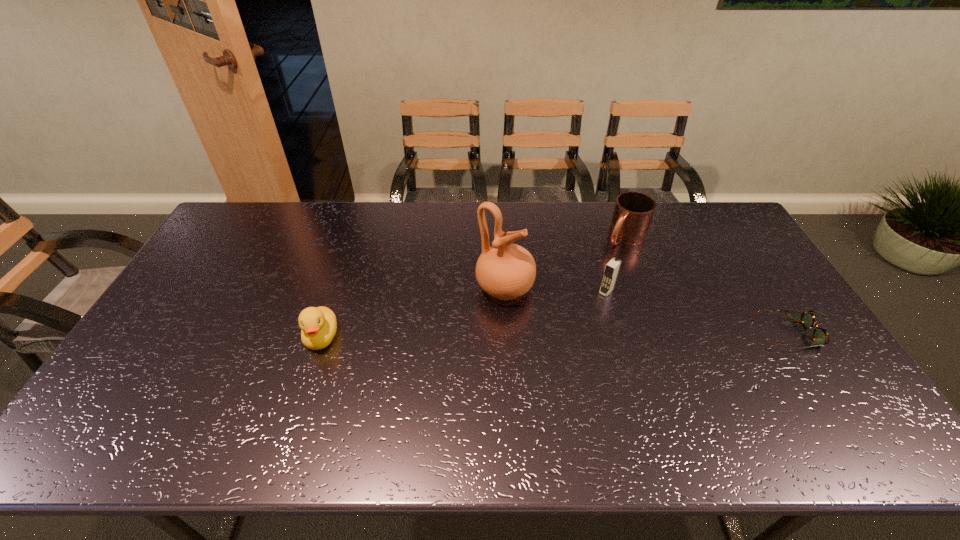
In order to click on vacant area that lies between the tallest object and the spectacles in this screenshot , I will do [x=650, y=311].

At what (x,y) coordinates should I click in order to perform the action: click on free area in between the farthest object and the second object from left to right. Please return your answer as a coordinate pair (x, y). Looking at the image, I should click on (565, 262).

This screenshot has width=960, height=540. What are the coordinates of `free space between the tallest object and the fourth shortest object` in the screenshot? It's located at (556, 290).

You are a GUI agent. You are given a task and a screenshot of the screen. Output one action in this format:
    pyautogui.click(x=<x>, y=<y>)
    Task: Click on the vacant space in between the third object from left to right and the leftmost object
    This screenshot has width=960, height=540.
    Given the screenshot: What is the action you would take?
    pyautogui.click(x=464, y=314)

The width and height of the screenshot is (960, 540). Find the location of `free point between the second tallest object and the duckling`. free point between the second tallest object and the duckling is located at coordinates (464, 314).

The height and width of the screenshot is (540, 960). What are the coordinates of `vacant region between the mug and the rightmost object` in the screenshot? It's located at (710, 285).

Where is `free space between the rightmost object and the second tallest object`? The width and height of the screenshot is (960, 540). free space between the rightmost object and the second tallest object is located at coordinates (701, 312).

The height and width of the screenshot is (540, 960). Find the location of `unoccupied area between the cellular telephone and the leftmost object`. unoccupied area between the cellular telephone and the leftmost object is located at coordinates (464, 314).

Identify which object is located as the fourth nearest to the mug. Please provide its 2D coordinates. Your answer should be formatted as a tuple, i.e. [(x, y)], where the tuple contains the x and y coordinates of a point satisfying the conditions above.

[(318, 325)]

Locate an element on the screen. Image resolution: width=960 pixels, height=540 pixels. object that ranks as the closest to the farthest object is located at coordinates (612, 268).